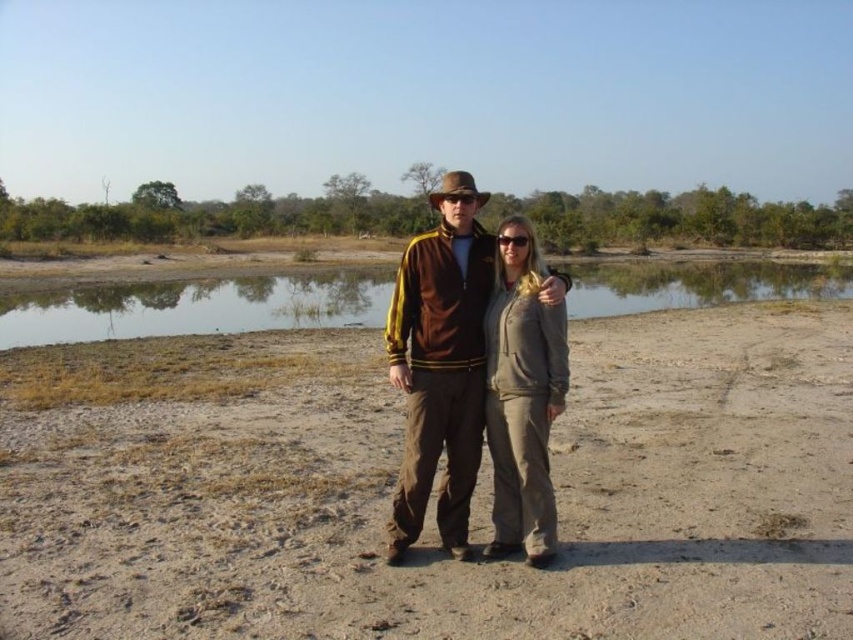
Who is taller, brown sandy dirt at center or light gray fleece pants at center?

Standing taller between the two is light gray fleece pants at center.

Measure the distance between point (x=825, y=422) and camera.

The distance of point (x=825, y=422) from camera is 7.95 meters.

Which is in front, point (610, 611) or point (505, 400)?

Positioned in front is point (610, 611).

You are a GUI agent. You are given a task and a screenshot of the screen. Output one action in this format:
    pyautogui.click(x=<x>, y=<y>)
    Task: Click on the brown sandy dirt at center
    
    Given the screenshot: What is the action you would take?
    pyautogui.click(x=433, y=490)

Is clear water at center thinner than light gray fleece pants at center?

Incorrect, clear water at center's width is not less than light gray fleece pants at center's.

Consider the image. Can you confirm if clear water at center is positioned to the right of light gray fleece pants at center?

Correct, you'll find clear water at center to the right of light gray fleece pants at center.

Is point (358, 285) less distant than point (524, 509)?

No, it is behind (524, 509).

Find the location of a particular element. The width and height of the screenshot is (853, 640). clear water at center is located at coordinates (196, 307).

Is clear water at center smaller than brown suede jacket at center?

No.

The height and width of the screenshot is (640, 853). What do you see at coordinates (196, 307) in the screenshot? I see `clear water at center` at bounding box center [196, 307].

Identify the location of clear water at center. (196, 307).